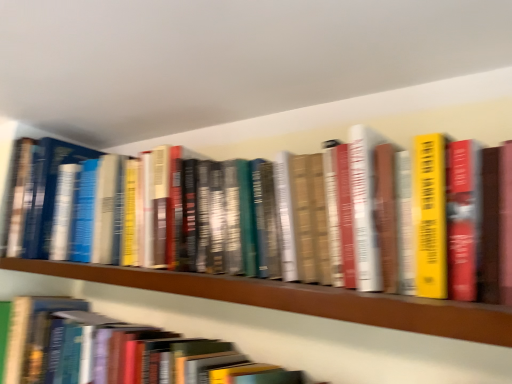
Question: Considering the relative positions of hardcover book at lower left and wooden shelf at center in the image provided, is hardcover book at lower left to the left or to the right of wooden shelf at center?

Choices:
 (A) right
 (B) left

Answer: (B)

Question: From the image's perspective, relative to wooden shelf at center, is hardcover book at lower left above or below?

Choices:
 (A) below
 (B) above

Answer: (A)

Question: Is hardcover book at lower left taller or shorter than wooden shelf at center?

Choices:
 (A) short
 (B) tall

Answer: (B)

Question: Is wooden shelf at center wider or thinner than hardcover book at lower left?

Choices:
 (A) thin
 (B) wide

Answer: (B)

Question: Is wooden shelf at center inside the boundaries of hardcover book at lower left, or outside?

Choices:
 (A) inside
 (B) outside

Answer: (B)

Question: From their relative heights in the image, would you say wooden shelf at center is taller or shorter than hardcover book at lower left?

Choices:
 (A) short
 (B) tall

Answer: (A)

Question: Visually, is wooden shelf at center positioned to the left or to the right of hardcover book at lower left?

Choices:
 (A) right
 (B) left

Answer: (A)